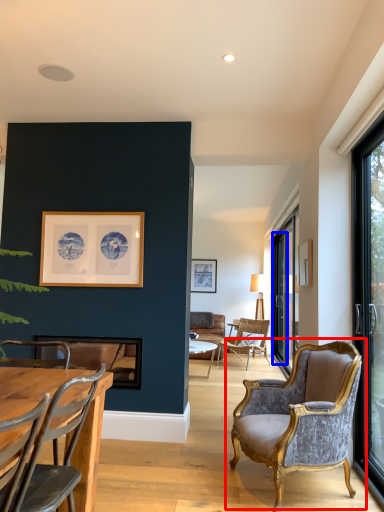
Question: Which object is further to the camera taking this photo, chair (highlighted by a red box) or screen door (highlighted by a blue box)?

Choices:
 (A) chair
 (B) screen door

Answer: (B)